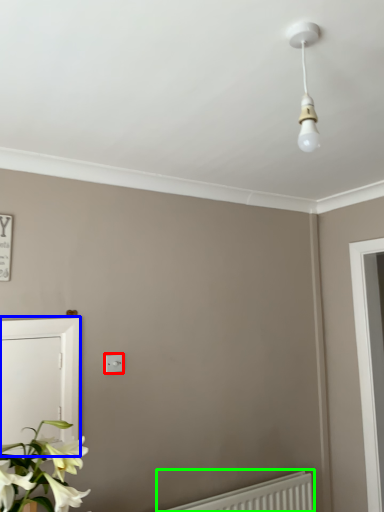
Question: Which object is the closest to the light switch (highlighted by a red box)? Choose among these: screen door (highlighted by a blue box) or radiator (highlighted by a green box).

Choices:
 (A) screen door
 (B) radiator

Answer: (A)